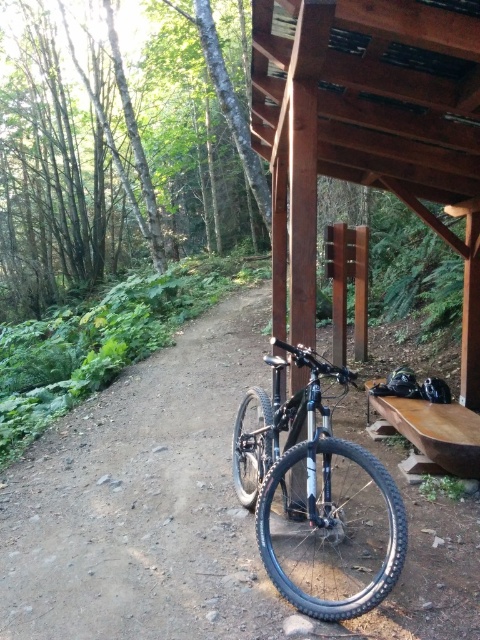
You are standing at the entrance of the forest trail and see the brown wooden shelter at upper center. If you want to reach the shelter, which direction should you walk towards?

The brown wooden shelter at upper center is located at point (x=370, y=129), so you should walk towards the upper center direction to reach it.

You are a hiker who wants to secure your backpack under the brown wooden shelter at upper center. However, there is a shiny black mountain bike at center in the way. Can you move the bike to access the shelter area?

The brown wooden shelter at upper center is positioned over the shiny black mountain bike at center, meaning the bike is directly beneath the shelter. To access the shelter area, you would need to move the bike from its current position under the shelter.